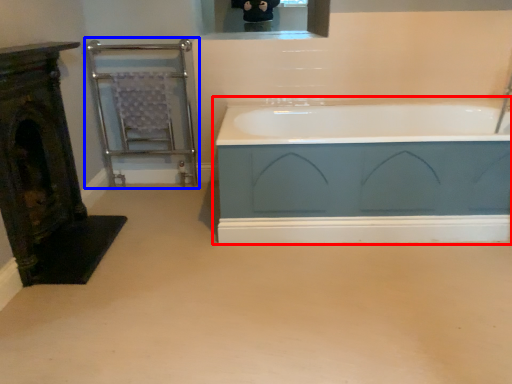
Question: Which of the following is the farthest to the observer, bathtub (highlighted by a red box) or balustrade (highlighted by a blue box)?

Choices:
 (A) bathtub
 (B) balustrade

Answer: (B)